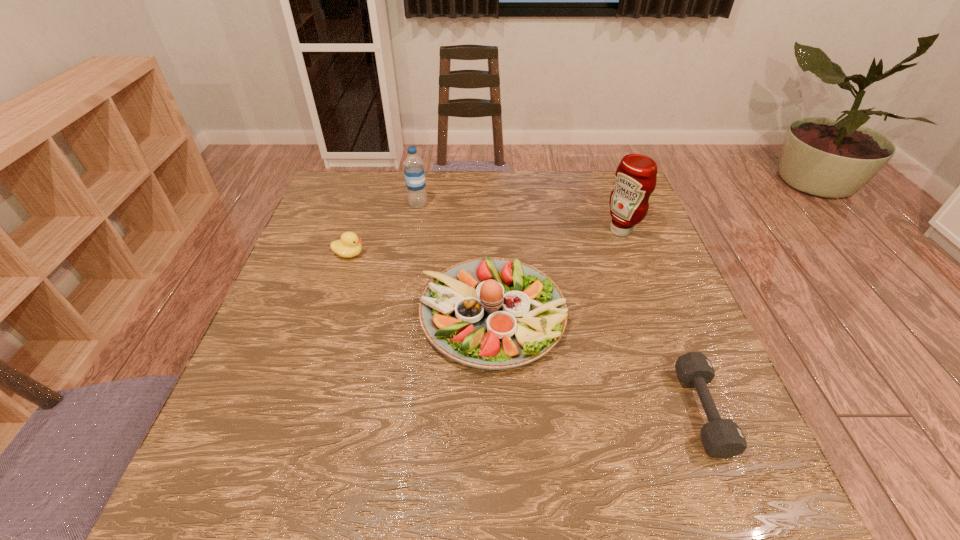
This screenshot has height=540, width=960. Identify the location of vacant space that satisfies the following two spatial constraints: 1. on the beak of the dumbbell; 2. on the left side of the leftmost object. (299, 410).

Find the location of a particular element. Image resolution: width=960 pixels, height=540 pixels. vacant space that satisfies the following two spatial constraints: 1. on the label of the water bottle; 2. on the right side of the second farthest object is located at coordinates (414, 231).

Where is `vacant space that satisfies the following two spatial constraints: 1. on the beak of the duckling; 2. on the back side of the salad plate`? The image size is (960, 540). vacant space that satisfies the following two spatial constraints: 1. on the beak of the duckling; 2. on the back side of the salad plate is located at coordinates (329, 315).

I want to click on free spot that satisfies the following two spatial constraints: 1. on the beak of the third shortest object; 2. on the left side of the duckling, so point(329,315).

The width and height of the screenshot is (960, 540). I want to click on free space that satisfies the following two spatial constraints: 1. on the label of the fourth shortest object; 2. on the left side of the condiment, so click(x=414, y=231).

Locate an element on the screen. The width and height of the screenshot is (960, 540). vacant area that satisfies the following two spatial constraints: 1. on the beak of the third farthest object; 2. on the right side of the third object from left to right is located at coordinates (329, 315).

This screenshot has height=540, width=960. In order to click on free space that satisfies the following two spatial constraints: 1. on the label of the third tallest object; 2. on the right side of the farthest object in this screenshot , I will do `click(398, 315)`.